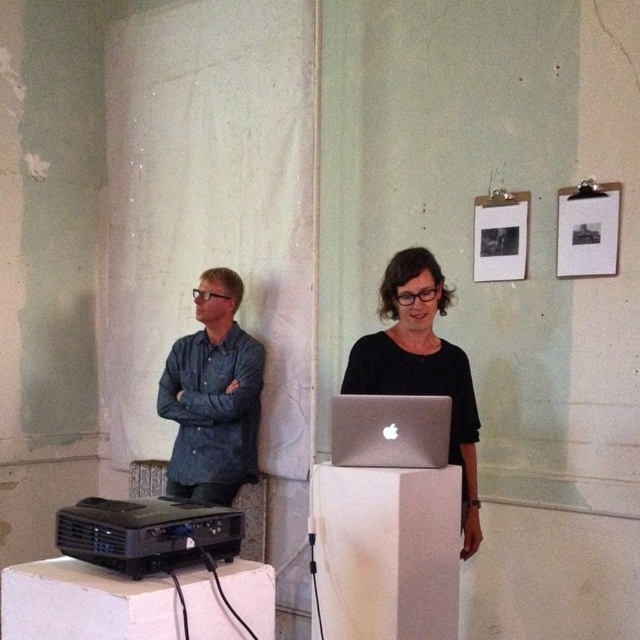
Does white fabric speaker at center have a lesser width compared to denim shirt at left?

Correct, white fabric speaker at center's width is less than denim shirt at left's.

Does point (385, 570) come in front of point (252, 454)?

Yes, point (385, 570) is closer to viewer.

Find the location of a particular element. white fabric speaker at center is located at coordinates (387, 552).

Is point (355, 378) less distant than point (406, 406)?

No, it is not.

Between point (461, 524) and point (429, 410), which one is positioned behind?

The point (461, 524) is behind.

The image size is (640, 640). In order to click on black matte laptop at center in this screenshot , I will do `click(420, 365)`.

Does denim shirt at left lie behind silver metallic laptop at center?

Yes, it is behind silver metallic laptop at center.

Can you confirm if denim shirt at left is wider than silver metallic laptop at center?

Correct, the width of denim shirt at left exceeds that of silver metallic laptop at center.

Is point (186, 449) farther from camera compared to point (448, 424)?

Yes.

Where is `denim shirt at left`? This screenshot has height=640, width=640. denim shirt at left is located at coordinates (212, 396).